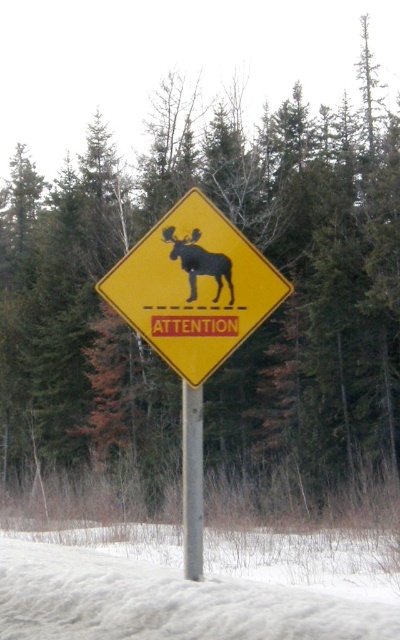
Where is `white fluffy snow at lower center`? This screenshot has height=640, width=400. white fluffy snow at lower center is located at coordinates (196, 586).

Is white fluffy snow at lower center thinner than yellow plastic diamond at center?

No, white fluffy snow at lower center is not thinner than yellow plastic diamond at center.

At what (x,y) coordinates should I click in order to perform the action: click on white fluffy snow at lower center. Please return your answer as a coordinate pair (x, y). The height and width of the screenshot is (640, 400). Looking at the image, I should click on (196, 586).

Which is above, white fluffy snow at lower center or black matte moose at center?

Positioned higher is black matte moose at center.

Who is more distant from viewer, (222, 632) or (192, 285)?

The point (192, 285) is behind.

The width and height of the screenshot is (400, 640). I want to click on white fluffy snow at lower center, so click(x=196, y=586).

Between white fluffy snow at lower center and metallic gray pole at center, which one has less height?

Standing shorter between the two is metallic gray pole at center.

Can you confirm if white fluffy snow at lower center is smaller than metallic gray pole at center?

No.

What do you see at coordinates (196, 586) in the screenshot? The image size is (400, 640). I see `white fluffy snow at lower center` at bounding box center [196, 586].

The width and height of the screenshot is (400, 640). Find the location of `white fluffy snow at lower center`. white fluffy snow at lower center is located at coordinates (196, 586).